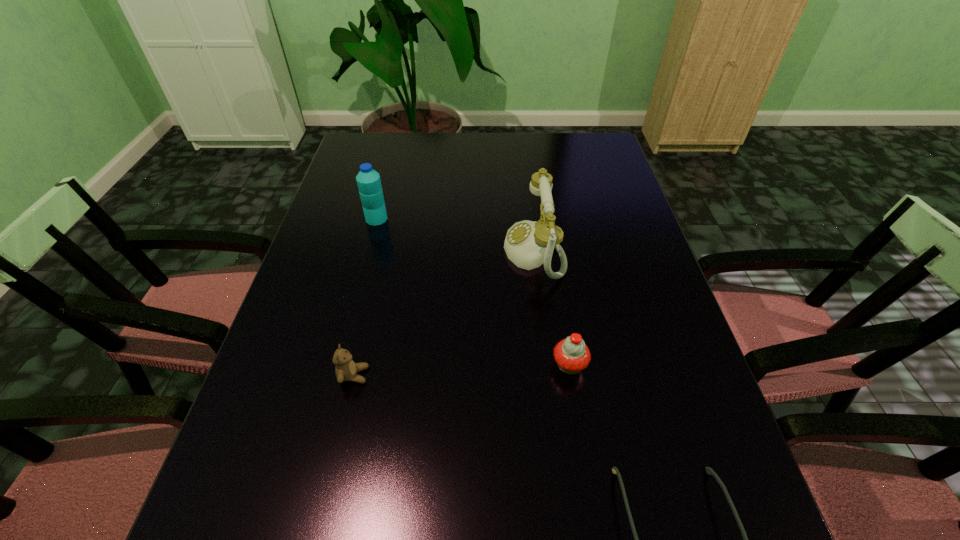
Find the location of a particular element. Image resolution: width=960 pixels, height=540 pixels. telephone is located at coordinates (528, 244).

What are the coordinates of `water bottle` in the screenshot? It's located at tap(368, 180).

I want to click on cupcake, so click(572, 355).

In order to click on teddy bear in this screenshot , I will do `click(346, 369)`.

This screenshot has width=960, height=540. I want to click on vacant space located on the dial of the telephone, so click(473, 252).

Where is `vacant space situated 0.300m on the dial of the telephone`? vacant space situated 0.300m on the dial of the telephone is located at coordinates (389, 252).

This screenshot has height=540, width=960. Find the location of `vacant area situated 0.290m on the dial of the telephone`. vacant area situated 0.290m on the dial of the telephone is located at coordinates tap(393, 252).

Find the location of a particular element. vacant space located 0.160m on the front of the water bottle is located at coordinates point(364,266).

Locate an element on the screen. This screenshot has width=960, height=540. blank area located 0.190m on the right of the cupcake is located at coordinates (680, 365).

Find the location of a particular element. The image size is (960, 540). vacant region located 0.090m on the front-facing side of the teddy bear is located at coordinates (412, 375).